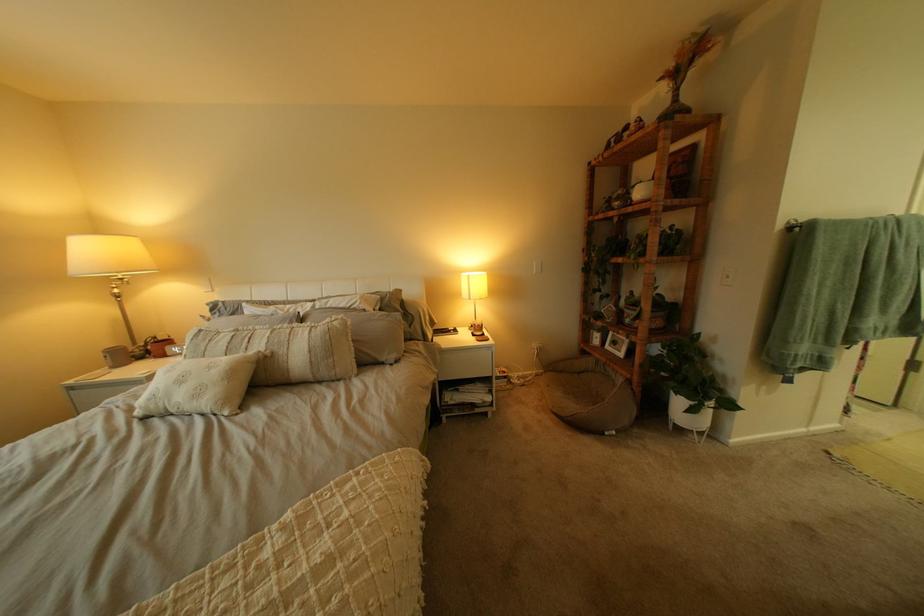
Locate an element on the screen. This screenshot has width=924, height=616. white light switch is located at coordinates (727, 276).